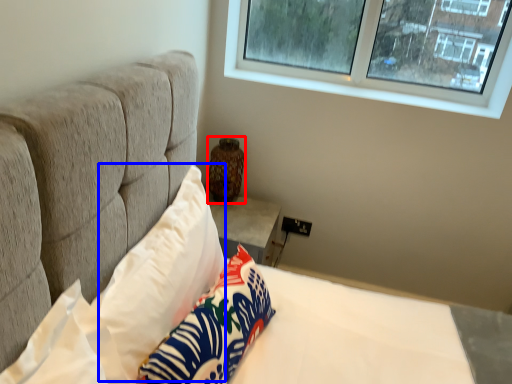
Question: Which object appears closest to the camera in this image, vase (highlighted by a red box) or pillow (highlighted by a blue box)?

Choices:
 (A) vase
 (B) pillow

Answer: (B)